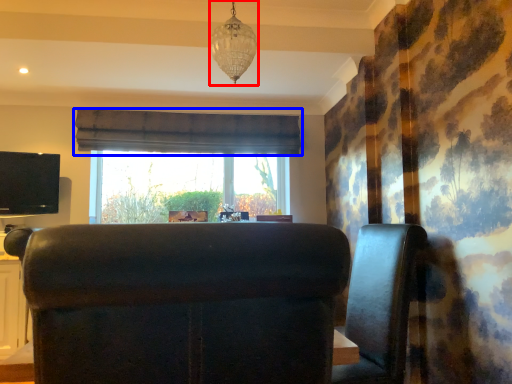
Question: Which point is further to the camera, lamp (highlighted by a red box) or curtain (highlighted by a blue box)?

Choices:
 (A) lamp
 (B) curtain

Answer: (B)